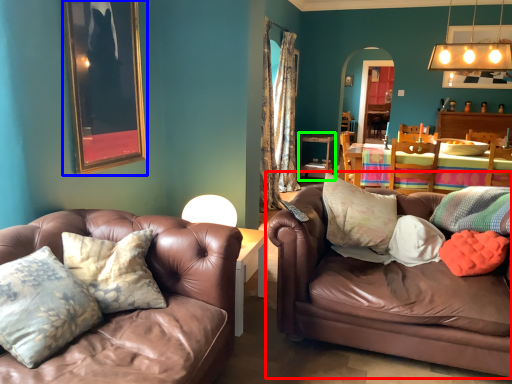
Question: Based on their relative distances, which object is nearer to studio couch (highlighted by a red box)? Choose from picture frame (highlighted by a blue box) and table (highlighted by a green box).

Choices:
 (A) picture frame
 (B) table

Answer: (A)